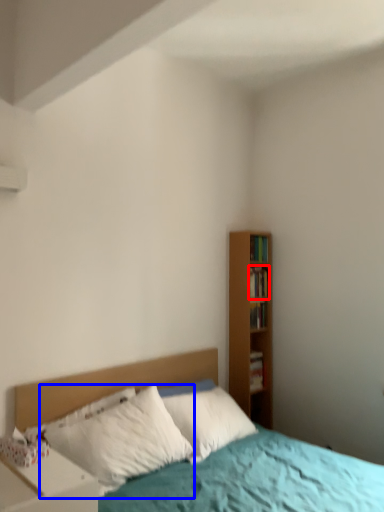
Question: Which of the following is the closest to the observer, book (highlighted by a red box) or pillow (highlighted by a blue box)?

Choices:
 (A) book
 (B) pillow

Answer: (B)